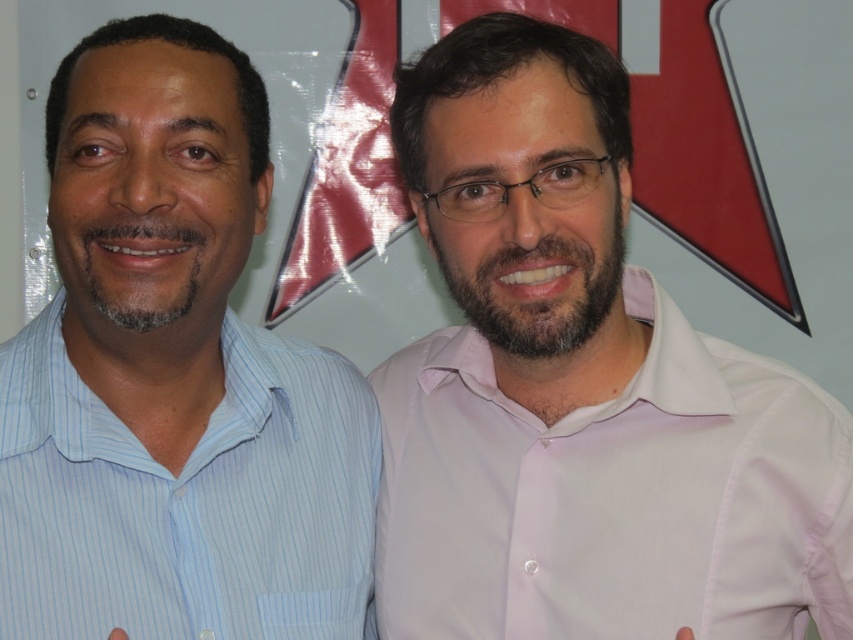
Question: Which point is closer to the camera taking this photo?

Choices:
 (A) (843, 627)
 (B) (271, 637)

Answer: (B)

Question: Can you confirm if pink smooth shirt at right is wider than blue striped shirt at left?

Choices:
 (A) no
 (B) yes

Answer: (B)

Question: Does pink smooth shirt at right appear under blue striped shirt at left?

Choices:
 (A) no
 (B) yes

Answer: (A)

Question: Which point is closer to the camera taking this photo?

Choices:
 (A) (370, 636)
 (B) (432, 552)

Answer: (B)

Question: Which point is closer to the camera?

Choices:
 (A) (733, 604)
 (B) (183, 608)

Answer: (B)

Question: Does pink smooth shirt at right have a larger size compared to blue striped shirt at left?

Choices:
 (A) no
 (B) yes

Answer: (B)